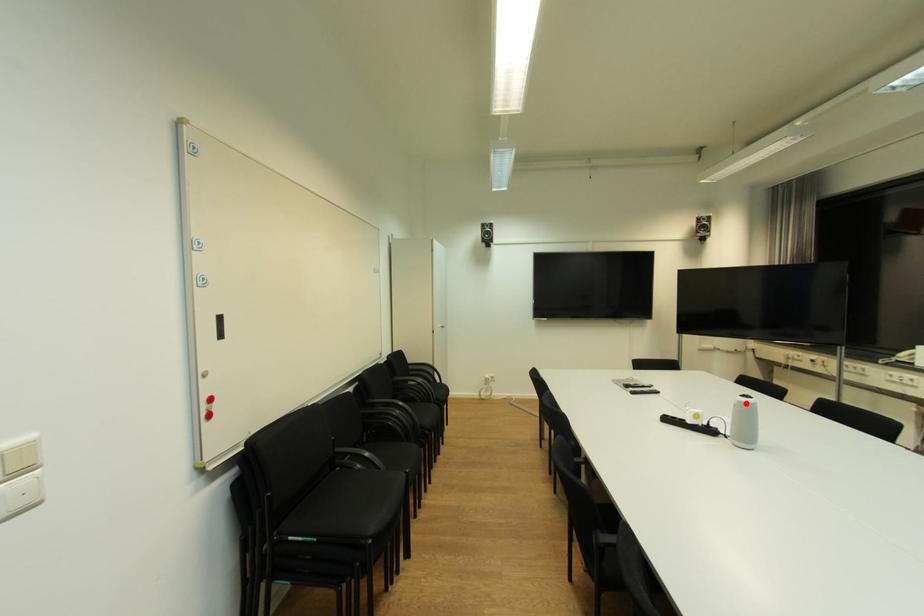
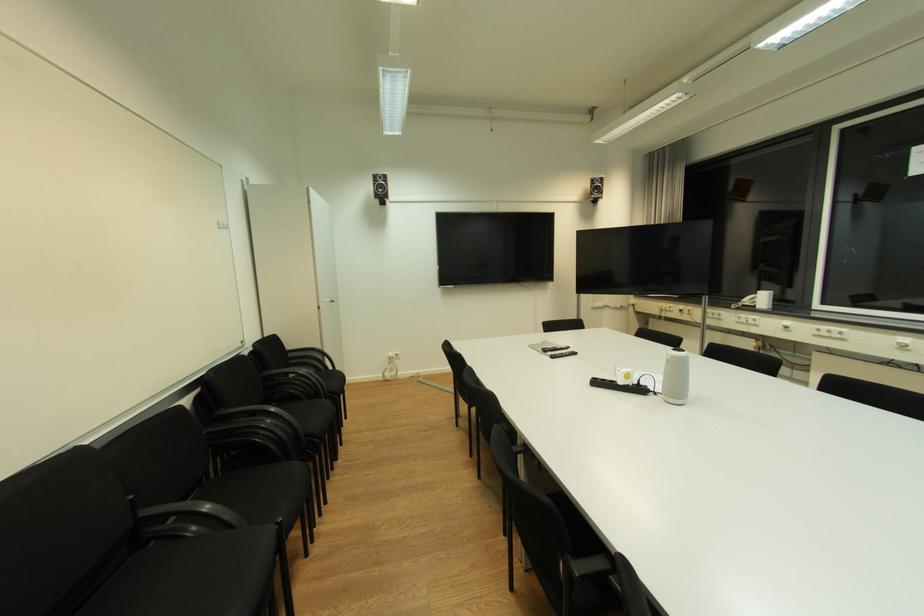
Where in the second image is the point corresponding to the highlighted location from the first image?

(678, 358)